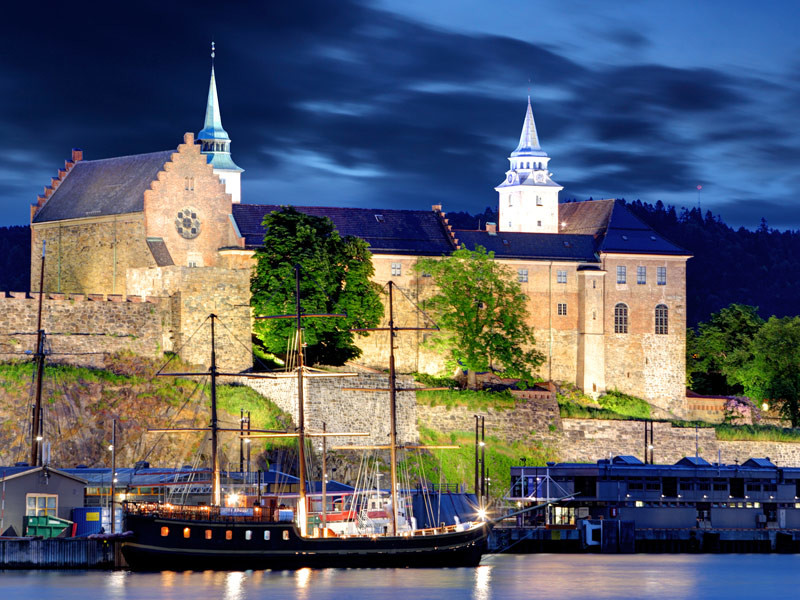
Locate an element on the screen. The height and width of the screenshot is (600, 800). windows is located at coordinates (198, 235), (532, 273), (574, 292), (554, 312), (620, 323), (669, 319), (614, 269), (649, 282), (678, 285), (405, 277).